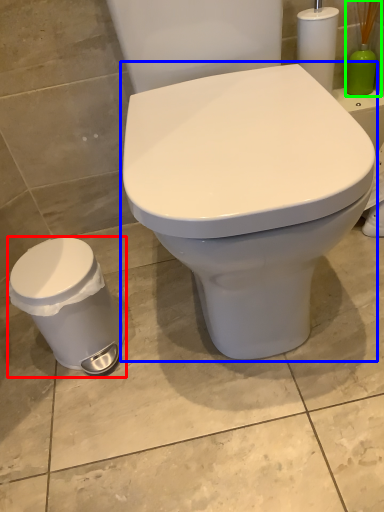
Question: Estimate the real-world distances between objects in this image. Which object is farther from porcelain (highlighted by a red box), toilet (highlighted by a blue box) or brush (highlighted by a green box)?

Choices:
 (A) toilet
 (B) brush

Answer: (B)